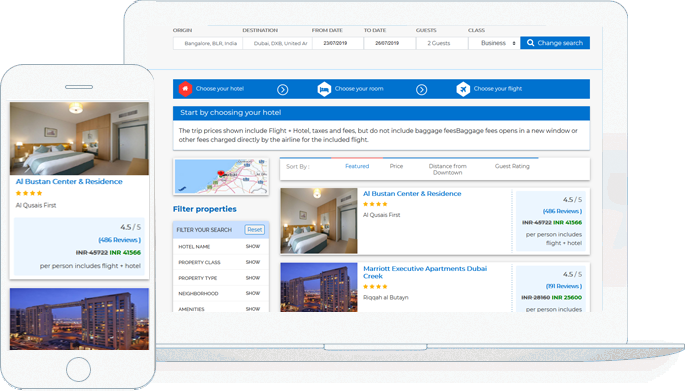
This screenshot has height=392, width=687. Identify the location of white outline of laptop. (350, 7).